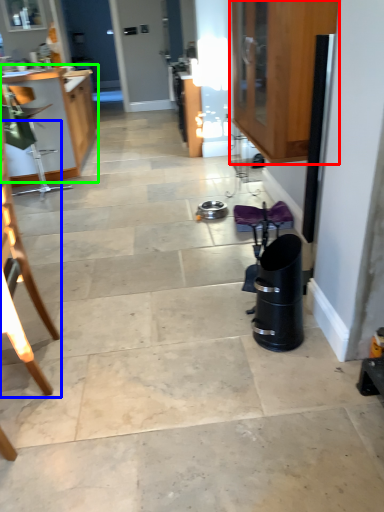
Question: Estimate the real-world distances between objects in this image. Which object is closer to cabinetry (highlighted by a red box), chair (highlighted by a blue box) or cabinetry (highlighted by a green box)?

Choices:
 (A) chair
 (B) cabinetry

Answer: (A)